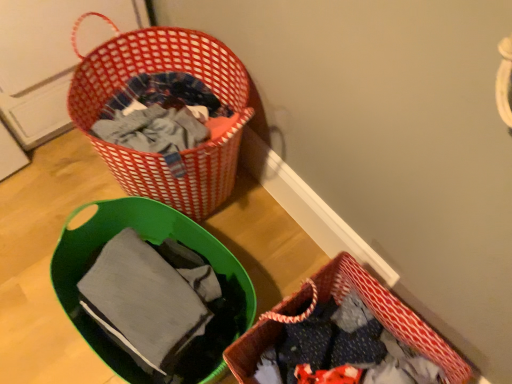
The height and width of the screenshot is (384, 512). I want to click on free space above matte gray fabric at lower left (from a real-world perspective), so click(x=145, y=282).